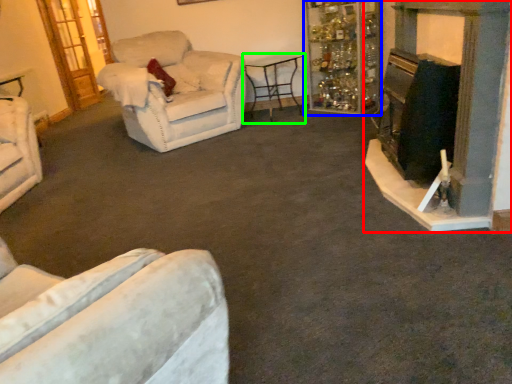
Question: Which object is positioned closest to fireplace (highlighted by a red box)? Select from shelf (highlighted by a blue box) and table (highlighted by a green box).

Choices:
 (A) shelf
 (B) table

Answer: (A)